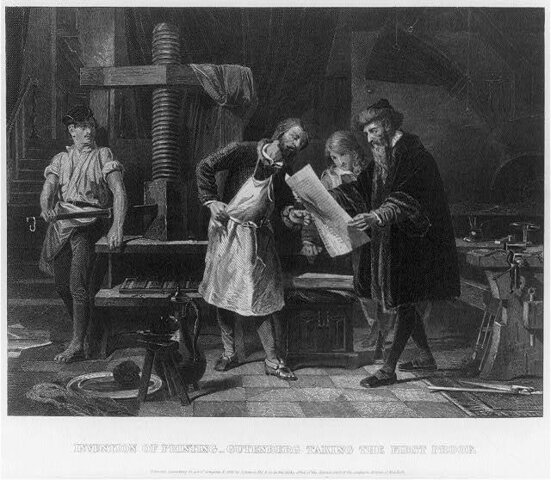
Locate an element on the screen. newspaper is located at coordinates (318, 205).